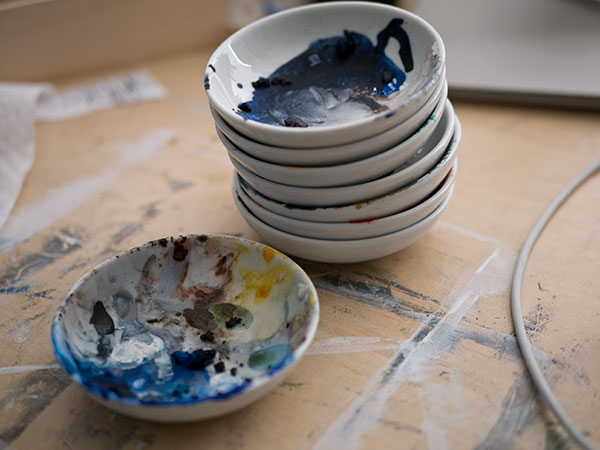
Identify the location of surface. Image resolution: width=600 pixels, height=450 pixels. (505, 178).